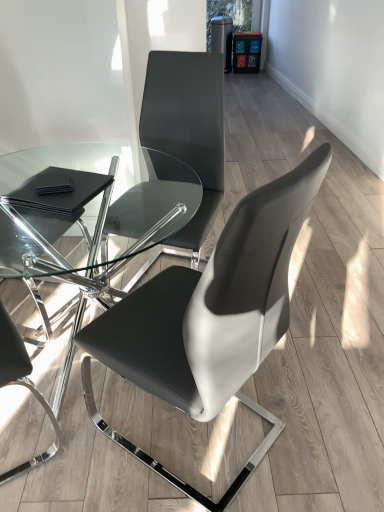
Find the location of a particular element. This screenshot has width=384, height=512. free point to the right of matte black chair at center, which is counted as the first chair, starting from the right is located at coordinates (316, 404).